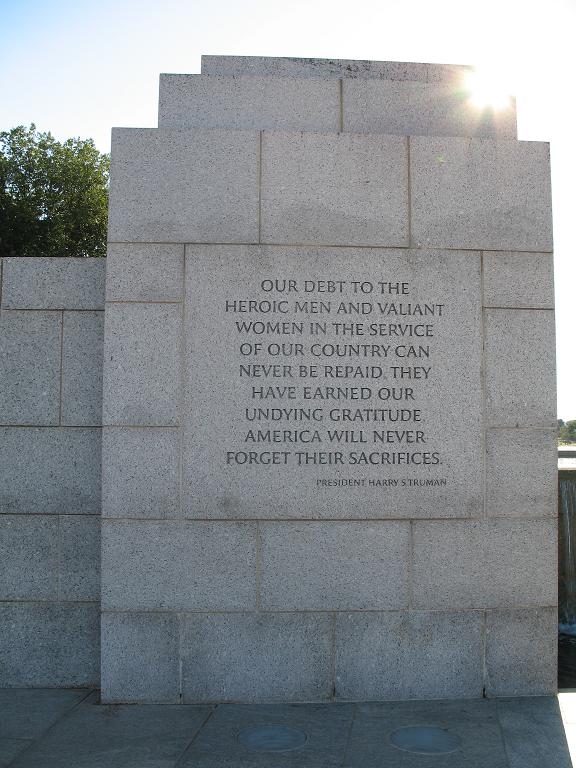
This screenshot has width=576, height=768. Identify the location of light covers. (269, 737), (428, 735).